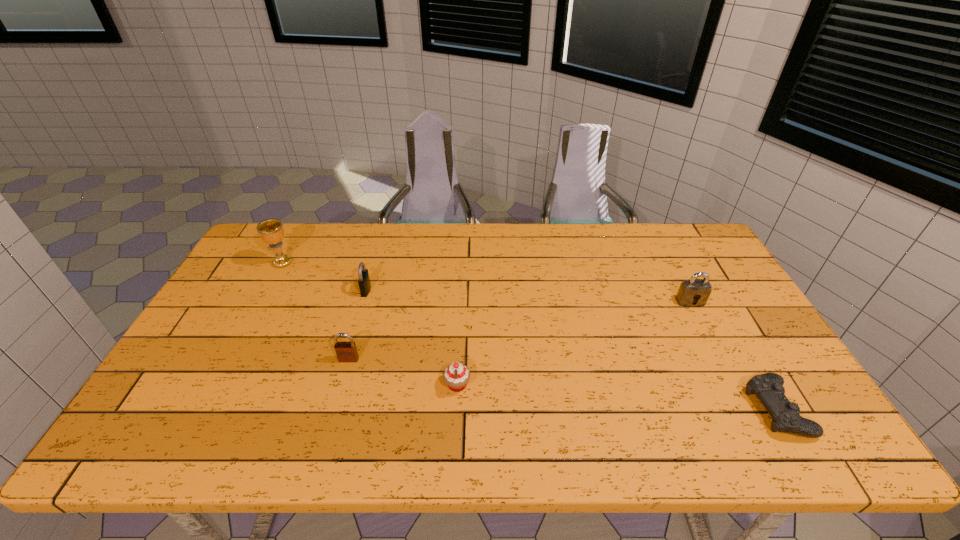
Point out which padlock is positioned as the second nearest to the nearest padlock. Please provide its 2D coordinates. Your answer should be formatted as a tuple, i.e. [(x, y)], where the tuple contains the x and y coordinates of a point satisfying the conditions above.

[(690, 290)]

Select which padlock is the second closest to the farthest object. Please provide its 2D coordinates. Your answer should be formatted as a tuple, i.e. [(x, y)], where the tuple contains the x and y coordinates of a point satisfying the conditions above.

[(346, 351)]

At what (x,y) coordinates should I click in order to perform the action: click on free space in the image that satisfies the following two spatial constraints: 1. on the front-facing side of the cupcake; 2. on the right side of the third nearest object. Please return your answer as a coordinate pair (x, y). The height and width of the screenshot is (540, 960). Looking at the image, I should click on (342, 385).

Where is `vacant point that satisfies the following two spatial constraints: 1. at the front of the control near the keyhole; 2. on the right side of the rightmost padlock`? The height and width of the screenshot is (540, 960). vacant point that satisfies the following two spatial constraints: 1. at the front of the control near the keyhole; 2. on the right side of the rightmost padlock is located at coordinates (745, 409).

In order to click on free space that satisfies the following two spatial constraints: 1. on the front-facing side of the cupcake; 2. on the right side of the nearest padlock in this screenshot , I will do `click(342, 385)`.